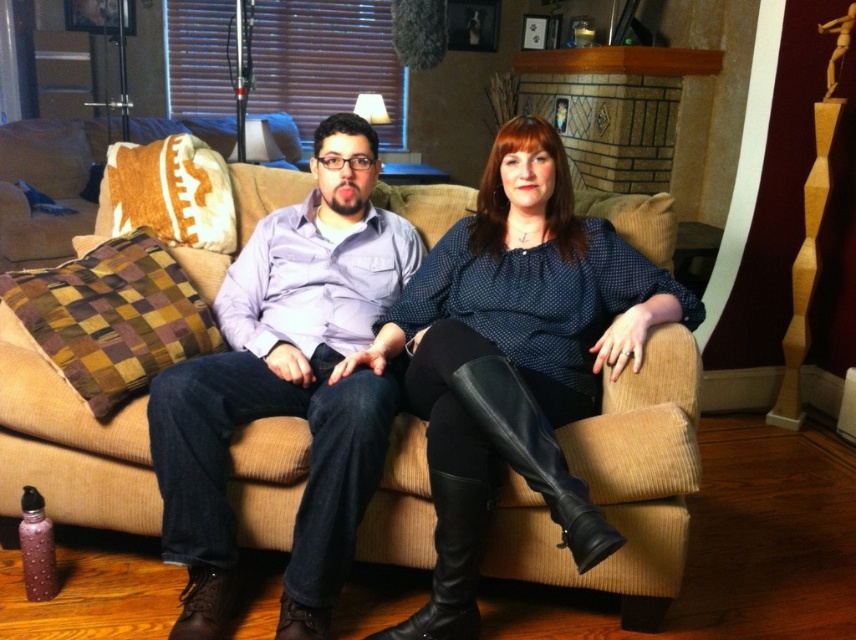
You are taking a photo of the matte purple shirt at center and the brown checkered pillow at left. Which object will appear larger in the photo?

The matte purple shirt at center will appear larger in the photo because it is closer to the viewer than the brown checkered pillow at left.

You are a photographer setting up a tripod to take a photo of the beige corduroy couch at center and the matte black boots at center. You want to ensure the couch is fully visible in the frame. Considering their heights, which object should be placed closer to the camera to achieve this?

The beige corduroy couch at center has a lesser height compared to matte black boots at center. To ensure the couch is fully visible, place it closer to the camera so its shorter height remains in frame while the taller boots can be adjusted accordingly.